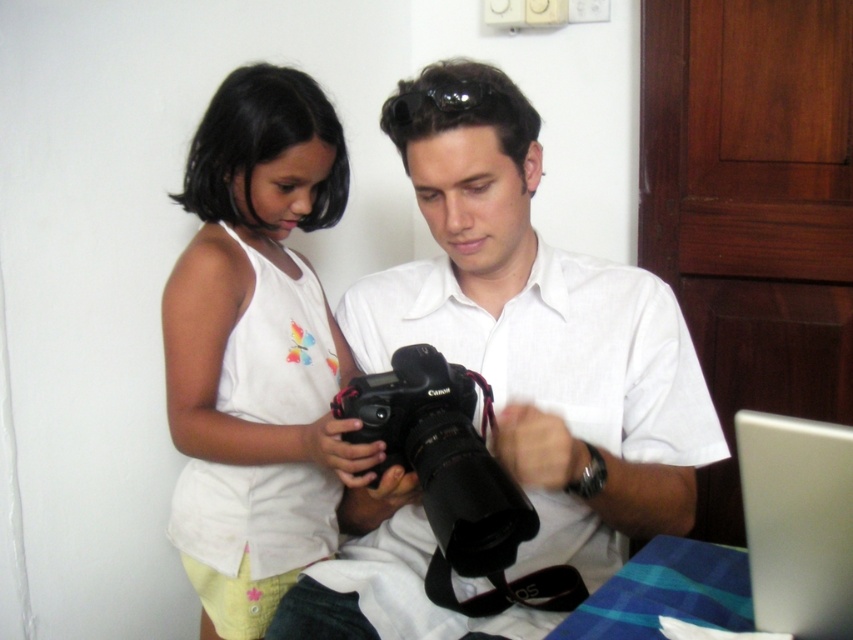
You are a photographer trying to determine which object is shorter between the matte black camera at center and the white cotton tank top at upper left. Which one is shorter?

The matte black camera at center is shorter than the white cotton tank top at upper left.